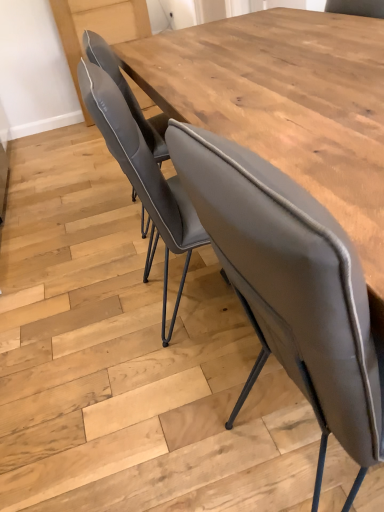
Question: Should I look upward or downward to see wooden table at center?

Choices:
 (A) up
 (B) down

Answer: (A)

Question: Does matte gray chair at center have a larger size compared to wooden table at center?

Choices:
 (A) yes
 (B) no

Answer: (A)

Question: Is matte gray chair at center beside wooden table at center?

Choices:
 (A) no
 (B) yes

Answer: (A)

Question: Is matte gray chair at center further to the viewer compared to wooden table at center?

Choices:
 (A) yes
 (B) no

Answer: (B)

Question: Is the position of matte gray chair at center less distant than that of wooden table at center?

Choices:
 (A) no
 (B) yes

Answer: (B)

Question: Is matte gray chair at center to the left of wooden table at center from the viewer's perspective?

Choices:
 (A) no
 (B) yes

Answer: (A)

Question: Is matte gray chair at center wider than wooden table at center?

Choices:
 (A) no
 (B) yes

Answer: (B)

Question: Are wooden table at center and matte gray chair at center located far from each other?

Choices:
 (A) no
 (B) yes

Answer: (A)

Question: Does wooden table at center appear on the right side of matte gray chair at center?

Choices:
 (A) yes
 (B) no

Answer: (B)

Question: Does wooden table at center come behind matte gray chair at center?

Choices:
 (A) no
 (B) yes

Answer: (B)

Question: Is wooden table at center facing away from matte gray chair at center?

Choices:
 (A) yes
 (B) no

Answer: (B)

Question: From a real-world perspective, is wooden table at center located beneath matte gray chair at center?

Choices:
 (A) no
 (B) yes

Answer: (B)

Question: From a real-world perspective, is wooden table at center on top of matte gray chair at center?

Choices:
 (A) no
 (B) yes

Answer: (A)

Question: Relative to wooden table at center, is matte gray chair at center in front or behind?

Choices:
 (A) behind
 (B) front

Answer: (B)